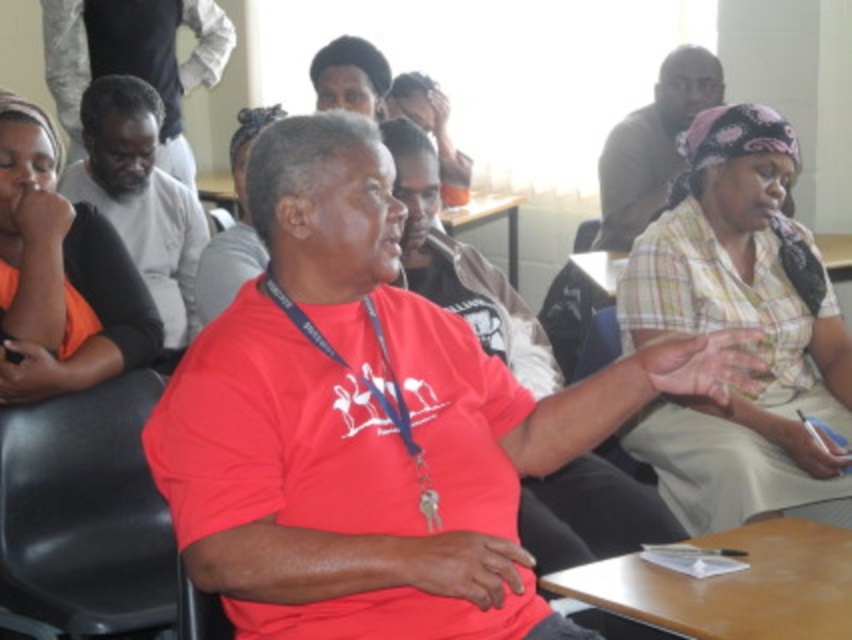
Question: Considering the relative positions of matte black shirt at upper right and wooden table at center in the image provided, where is matte black shirt at upper right located with respect to wooden table at center?

Choices:
 (A) left
 (B) right

Answer: (B)

Question: Which object is positioned closest to the matte black shirt at left?

Choices:
 (A) matte black shirt at upper right
 (B) wooden table at right

Answer: (B)

Question: Observing the image, what is the correct spatial positioning of black plastic chair at left in reference to matte black shirt at upper right?

Choices:
 (A) above
 (B) below

Answer: (B)

Question: Which point is closer to the camera taking this photo?

Choices:
 (A) (104, 97)
 (B) (38, 540)
 (C) (835, 268)
 (D) (9, 202)

Answer: (B)

Question: Considering the real-world distances, which object is farthest from the wooden table at lower right?

Choices:
 (A) black plastic chair at left
 (B) wooden table at center

Answer: (B)

Question: Does matte black shirt at upper right have a larger size compared to black plastic chair at center?

Choices:
 (A) yes
 (B) no

Answer: (A)